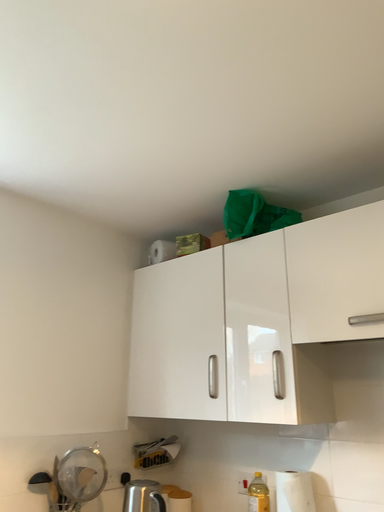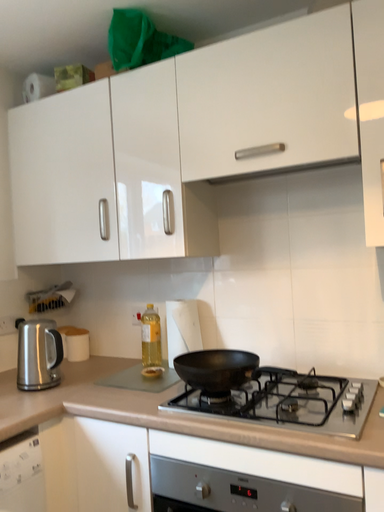
Question: How did the camera likely rotate when shooting the video?

Choices:
 (A) rotated downward
 (B) rotated upward

Answer: (A)